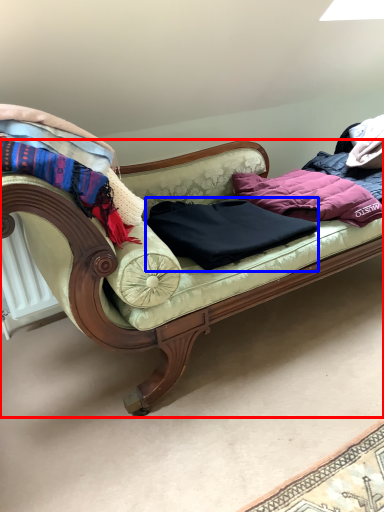
Question: Which point is closer to the camera, studio couch (highlighted by a red box) or clothing (highlighted by a blue box)?

Choices:
 (A) studio couch
 (B) clothing

Answer: (A)